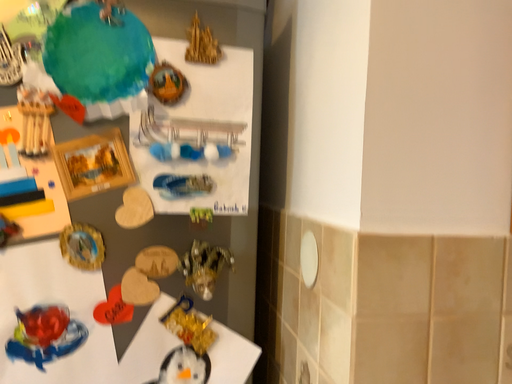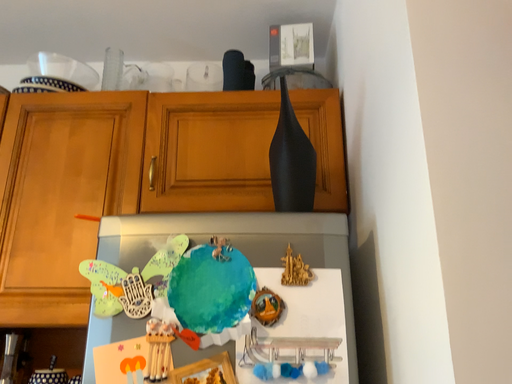
Question: How did the camera likely rotate when shooting the video?

Choices:
 (A) rotated downward
 (B) rotated upward

Answer: (B)